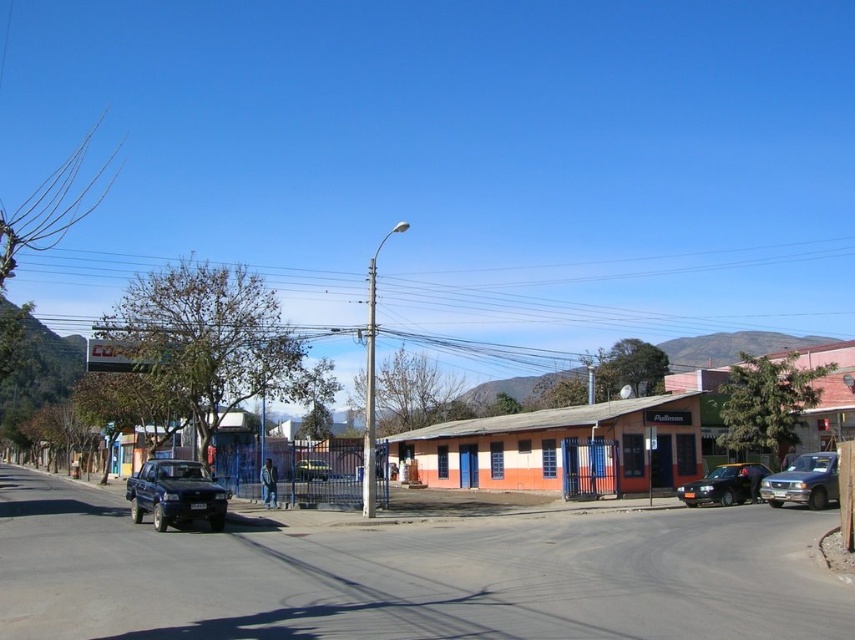
Question: Which object appears closest to the camera in this image?

Choices:
 (A) matte black truck at lower left
 (B) shiny black sedan at center
 (C) metallic blue truck at right

Answer: (A)

Question: Which of the following is the closest to the observer?

Choices:
 (A) (169, 460)
 (B) (296, 465)

Answer: (A)

Question: Is metallic blue truck at right above shiny black sedan at center?

Choices:
 (A) no
 (B) yes

Answer: (B)

Question: Can you confirm if matte black truck at lower left is wider than metallic blue truck at center?

Choices:
 (A) yes
 (B) no

Answer: (A)

Question: Among these objects, which one is farthest from the camera?

Choices:
 (A) shiny black sedan at center
 (B) matte black truck at lower left

Answer: (A)

Question: Is matte black truck at lower left wider than metallic blue truck at center?

Choices:
 (A) yes
 (B) no

Answer: (A)